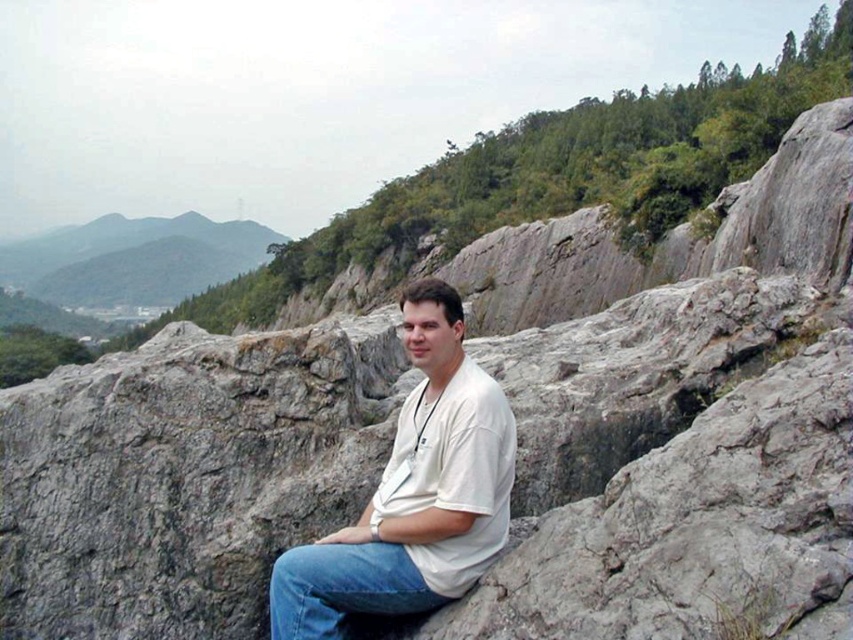
Question: Is green grassy hill at upper left below denim at center?

Choices:
 (A) yes
 (B) no

Answer: (B)

Question: Which point is farther to the camera?

Choices:
 (A) white matte shirt at center
 (B) green grassy hill at upper left

Answer: (B)

Question: Which point is farther to the camera?

Choices:
 (A) (25, 246)
 (B) (338, 636)
 (C) (454, 365)

Answer: (A)

Question: Is white matte shirt at center below denim at center?

Choices:
 (A) yes
 (B) no

Answer: (B)

Question: In this image, where is white matte shirt at center located relative to denim at center?

Choices:
 (A) above
 (B) below

Answer: (A)

Question: Which object is positioned closest to the green grassy hill at upper left?

Choices:
 (A) white matte shirt at center
 (B) denim at center

Answer: (B)